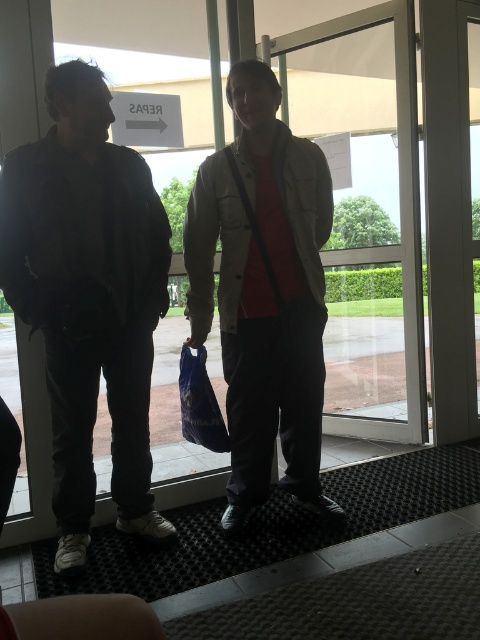
Does matte black jacket at left have a greater height compared to transparent glass door at center?

Correct, matte black jacket at left is much taller as transparent glass door at center.

Locate an element on the screen. This screenshot has height=640, width=480. matte black jacket at left is located at coordinates pos(88,298).

Can you confirm if transparent glass door at center is thinner than blue plastic bag at center?

Incorrect, transparent glass door at center's width is not less than blue plastic bag at center's.

Is transparent glass door at center above blue plastic bag at center?

Indeed, transparent glass door at center is positioned over blue plastic bag at center.

The image size is (480, 640). In order to click on transparent glass door at center in this screenshot , I will do point(365,212).

Can you confirm if matte black jacket at left is thinner than light beige jacket at center?

Indeed, matte black jacket at left has a lesser width compared to light beige jacket at center.

Is matte black jacket at left bigger than light beige jacket at center?

No, matte black jacket at left is not bigger than light beige jacket at center.

Who is more distant from viewer, [115,384] or [249,248]?

Positioned behind is point [249,248].

You are a GUI agent. You are given a task and a screenshot of the screen. Output one action in this format:
    pyautogui.click(x=<x>, y=<y>)
    Task: Click on the matte black jacket at left
    Image resolution: width=480 pixels, height=640 pixels.
    Given the screenshot: What is the action you would take?
    pyautogui.click(x=88, y=298)